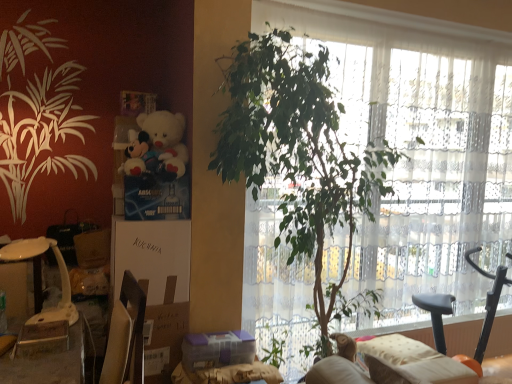
Question: Considering the positions of white plastic table at lower left and brown cardboard box at lower left, the first cardboard box from the bottom, in the image, is white plastic table at lower left bigger or smaller than brown cardboard box at lower left, the first cardboard box from the bottom,?

Choices:
 (A) small
 (B) big

Answer: (A)

Question: Considering the relative positions of white plastic table at lower left and brown cardboard box at lower left, placed as the 2th cardboard box when sorted from top to bottom, in the image provided, is white plastic table at lower left to the left or to the right of brown cardboard box at lower left, placed as the 2th cardboard box when sorted from top to bottom,?

Choices:
 (A) right
 (B) left

Answer: (B)

Question: Estimate the real-world distances between objects in this image. Which object is closer to the transparent glass window at center?

Choices:
 (A) brown cardboard box at lower left, the first cardboard box from the bottom
 (B) white plastic table at lower left
 (C) white plush toy at upper left
 (D) beige fabric couch at lower right
 (E) white cardboard box at center-left, marked as the 1th cardboard box in a top-to-bottom arrangement

Answer: (D)

Question: Based on their relative distances, which object is nearer to the beige fabric couch at lower right?

Choices:
 (A) white plush toy at upper left
 (B) transparent glass window at center
 (C) white plastic table at lower left
 (D) green leafy plant at center
 (E) brown cardboard box at lower left, the first cardboard box from the bottom

Answer: (D)